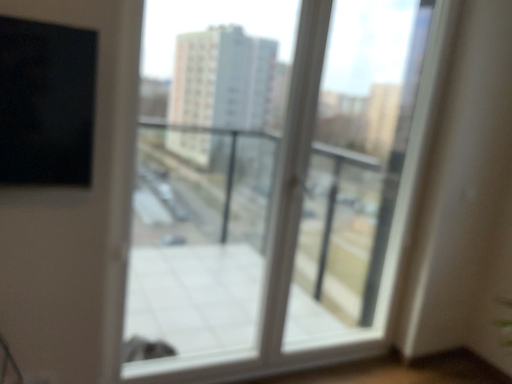
Question: Considering the positions of point (148, 263) and point (381, 162), is point (148, 263) closer or farther from the camera than point (381, 162)?

Choices:
 (A) farther
 (B) closer

Answer: (B)

Question: From the image's perspective, is transparent glass window at center positioned above or below white plastic screen door at center?

Choices:
 (A) below
 (B) above

Answer: (B)

Question: Which is correct: transparent glass window at center is inside white plastic screen door at center, or outside of it?

Choices:
 (A) outside
 (B) inside

Answer: (A)

Question: Does point (404, 24) appear closer or farther from the camera than point (331, 120)?

Choices:
 (A) farther
 (B) closer

Answer: (B)

Question: Is white plastic screen door at center wider or thinner than transparent glass window at center?

Choices:
 (A) thin
 (B) wide

Answer: (A)

Question: Considering the relative positions of white plastic screen door at center and transparent glass window at center in the image provided, is white plastic screen door at center to the left or to the right of transparent glass window at center?

Choices:
 (A) right
 (B) left

Answer: (A)

Question: Is white plastic screen door at center taller or shorter than transparent glass window at center?

Choices:
 (A) tall
 (B) short

Answer: (B)